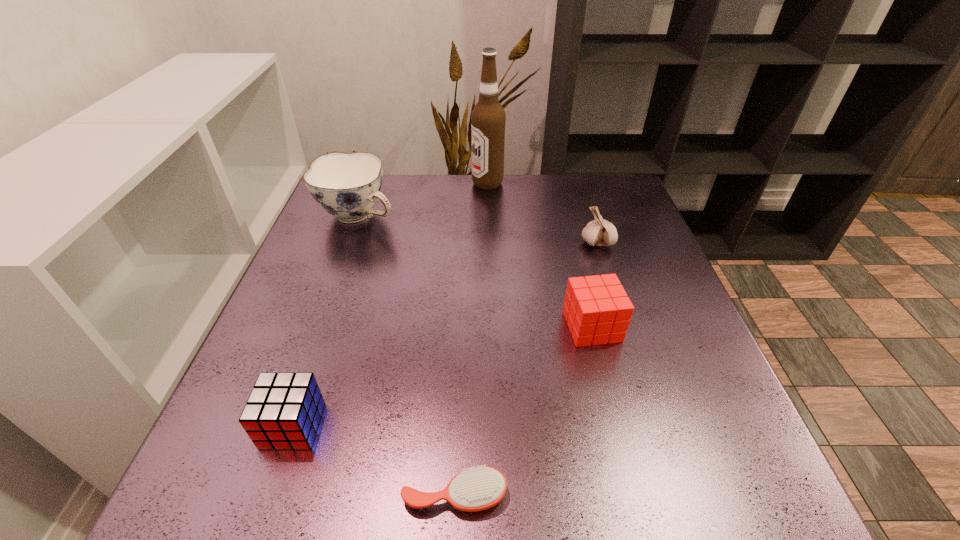
Image resolution: width=960 pixels, height=540 pixels. What are the coordinates of `vacant area that lies between the second nearest object and the alcohol` in the screenshot? It's located at (390, 304).

I want to click on vacant space in between the right cube and the alcohol, so (540, 255).

Identify the location of empty location between the garlic and the tallest object. (542, 213).

Where is `free spot between the hairbrush and the nearer cube`? The height and width of the screenshot is (540, 960). free spot between the hairbrush and the nearer cube is located at coordinates (373, 460).

At what (x,y) coordinates should I click in order to perform the action: click on vacant area that lies between the shortest object and the chinaware. Please return your answer as a coordinate pair (x, y). Looking at the image, I should click on (407, 355).

Find the location of a particular element. The image size is (960, 540). vacant area between the fifth farthest object and the nearest object is located at coordinates pos(373,460).

Identify the location of free area in between the chinaware and the garlic. (478, 229).

Find the location of a particular element. The image size is (960, 540). vacant point located between the garlic and the second tallest object is located at coordinates (478, 229).

Find the location of a particular element. The image size is (960, 540). unoccupied area between the garlic and the alcohol is located at coordinates (542, 213).

Locate an element on the screen. free area in between the hairbrush and the farthest object is located at coordinates (471, 339).